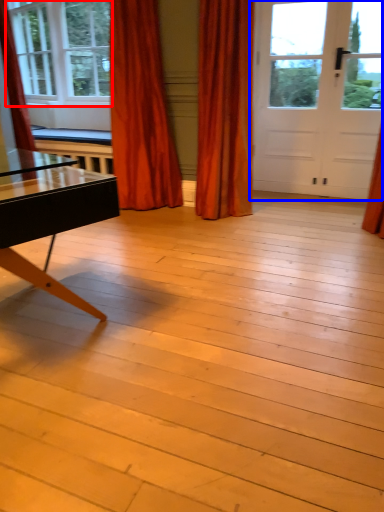
Question: Among these objects, which one is nearest to the camera, window (highlighted by a red box) or door (highlighted by a blue box)?

Choices:
 (A) window
 (B) door

Answer: (B)